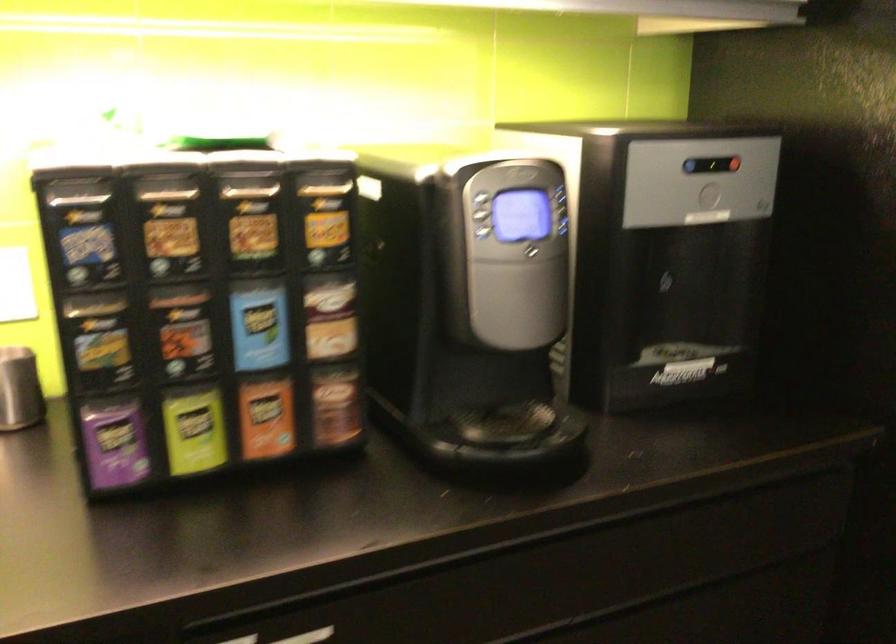
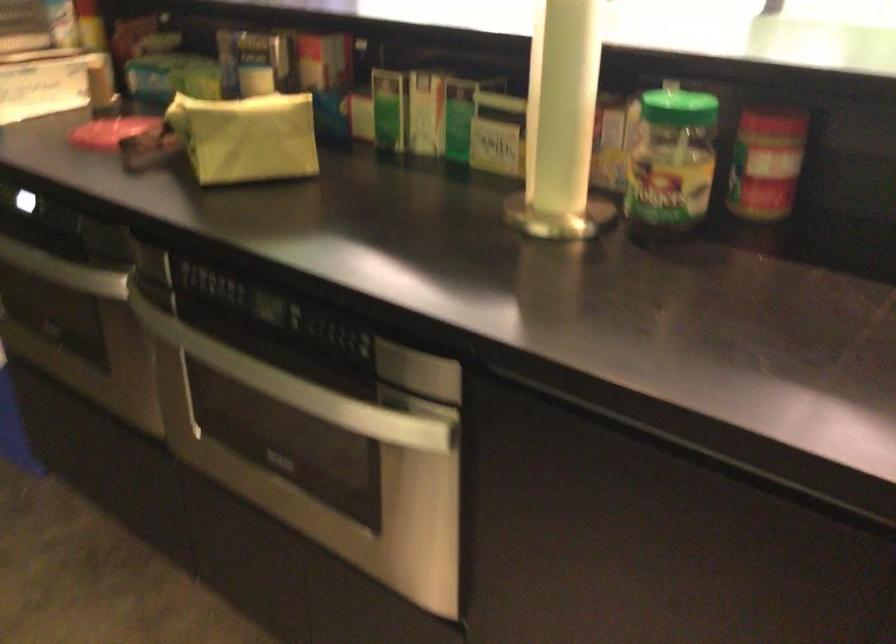
The images are taken continuously from a first-person perspective. In which direction is your viewpoint rotating?

The rotation direction of the camera is right-down.